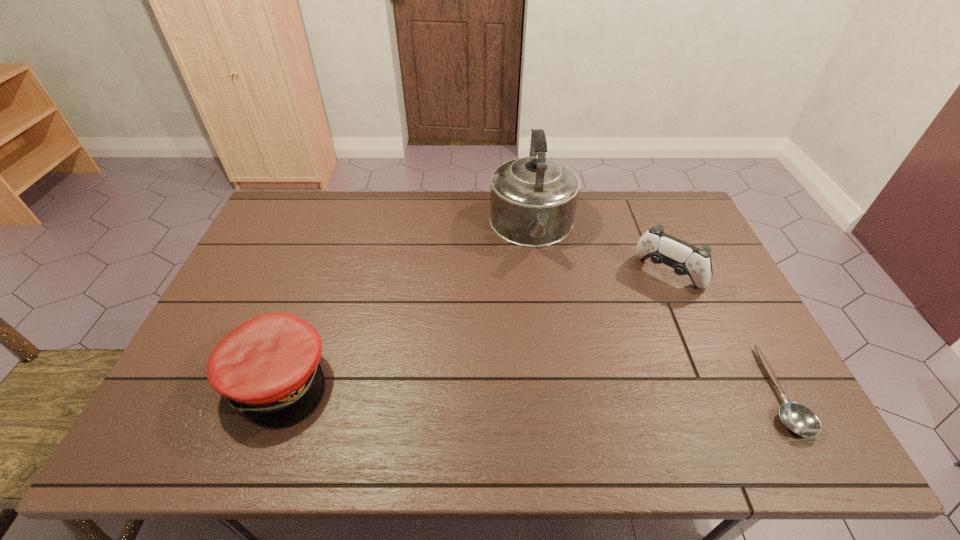
The height and width of the screenshot is (540, 960). Identify the location of free area in between the second object from right to left and the second object from left to right. (600, 252).

Image resolution: width=960 pixels, height=540 pixels. In order to click on free space between the tallest object and the second object from right to left in this screenshot , I will do `click(600, 252)`.

I want to click on vacant area between the second shortest object and the control, so click(473, 327).

Where is `empty space between the third tallest object and the rightmost object`? The image size is (960, 540). empty space between the third tallest object and the rightmost object is located at coordinates (528, 386).

You are a GUI agent. You are given a task and a screenshot of the screen. Output one action in this format:
    pyautogui.click(x=<x>, y=<y>)
    Task: Click on the vacant space in between the control and the cap
    The image size is (960, 540).
    Given the screenshot: What is the action you would take?
    pyautogui.click(x=473, y=327)

Where is `free spot between the leftmost object and the kettle`? This screenshot has height=540, width=960. free spot between the leftmost object and the kettle is located at coordinates (405, 305).

Identify the location of vacant point located between the third tallest object and the ladle. point(528,386).

I want to click on blank region between the ladle and the tallest object, so click(655, 309).

Find the location of a particular element. The height and width of the screenshot is (540, 960). free space between the tallest object and the cap is located at coordinates (405, 305).

Where is `the second closest object to the rightmost object`? This screenshot has height=540, width=960. the second closest object to the rightmost object is located at coordinates (533, 199).